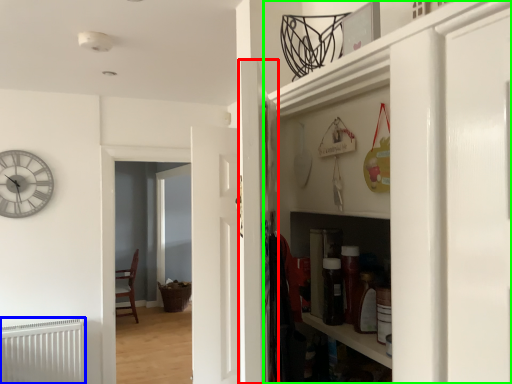
Question: Which object is positioned farthest from door (highlighted by a red box)? Select from radiator (highlighted by a blue box) and cabinetry (highlighted by a green box).

Choices:
 (A) radiator
 (B) cabinetry

Answer: (A)